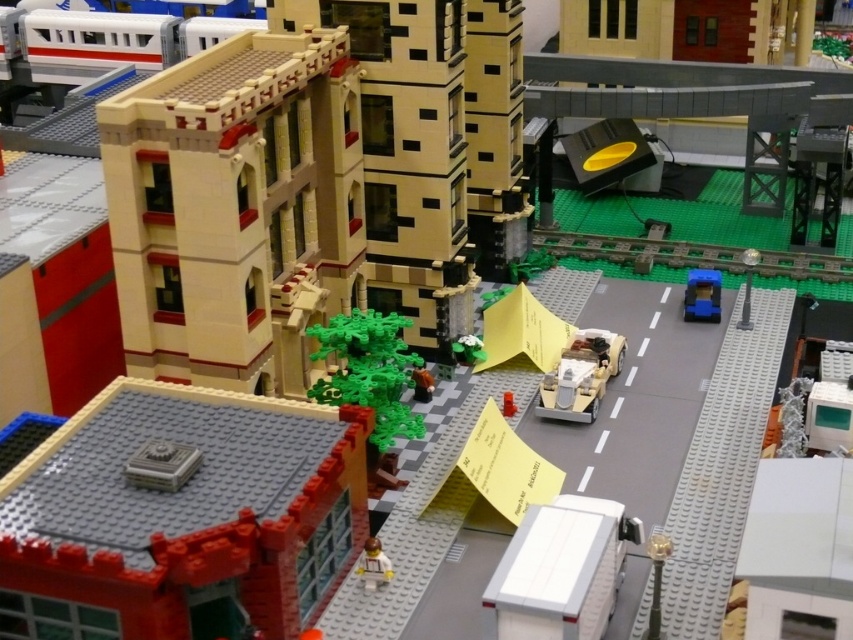
Question: Estimate the real-world distances between objects in this image. Which object is closer to the blue plastic car at right?

Choices:
 (A) green matte minifigure at center
 (B) brown matte teddy bear at center
 (C) smooth red brick building at lower left

Answer: (A)

Question: Which of these objects is positioned closest to the green plastic tree at center?

Choices:
 (A) gold metallic car at center
 (B) smooth red brick building at lower left

Answer: (A)

Question: Among these objects, which one is farthest from the camera?

Choices:
 (A) green plastic tree at center
 (B) gold metallic car at center

Answer: (B)

Question: Is gold metallic car at center to the left of brown matte teddy bear at center from the viewer's perspective?

Choices:
 (A) no
 (B) yes

Answer: (A)

Question: Is white plastic van at lower center to the left of smooth beige minifigure at lower center from the viewer's perspective?

Choices:
 (A) yes
 (B) no

Answer: (B)

Question: Can you confirm if gold metallic car at center is positioned to the left of smooth beige minifigure at lower center?

Choices:
 (A) yes
 (B) no

Answer: (B)